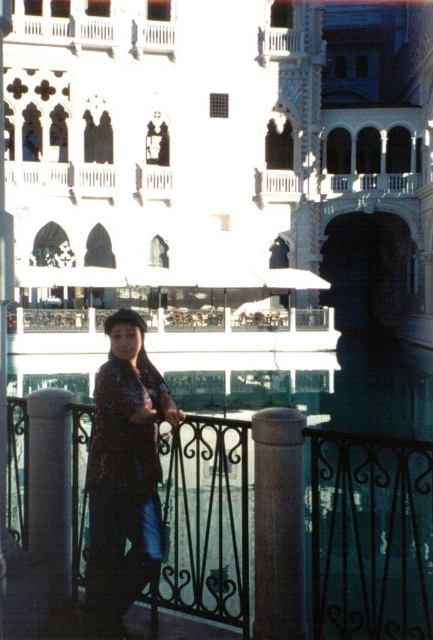
Question: Is white stone palace at center thinner than metallic wrought iron at center?

Choices:
 (A) yes
 (B) no

Answer: (B)

Question: Can you confirm if metallic wrought iron at center is smaller than white wooden balcony at upper center?

Choices:
 (A) no
 (B) yes

Answer: (A)

Question: Does metallic wrought iron at center have a larger size compared to shiny purple blouse at center?

Choices:
 (A) yes
 (B) no

Answer: (A)

Question: Which is nearer to the white glossy pillar at left?

Choices:
 (A) shiny purple blouse at center
 (B) metallic wrought iron at center

Answer: (A)

Question: Among these objects, which one is nearest to the camera?

Choices:
 (A) metallic wrought iron at center
 (B) white wooden balcony at upper center

Answer: (A)

Question: Which of the following is the farthest from the observer?

Choices:
 (A) (123, 531)
 (B) (164, 45)

Answer: (B)